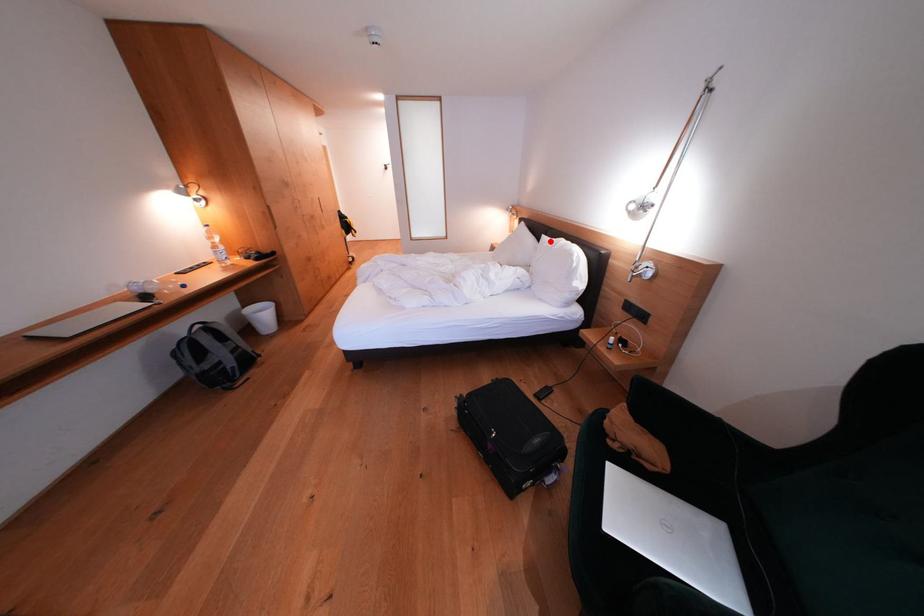
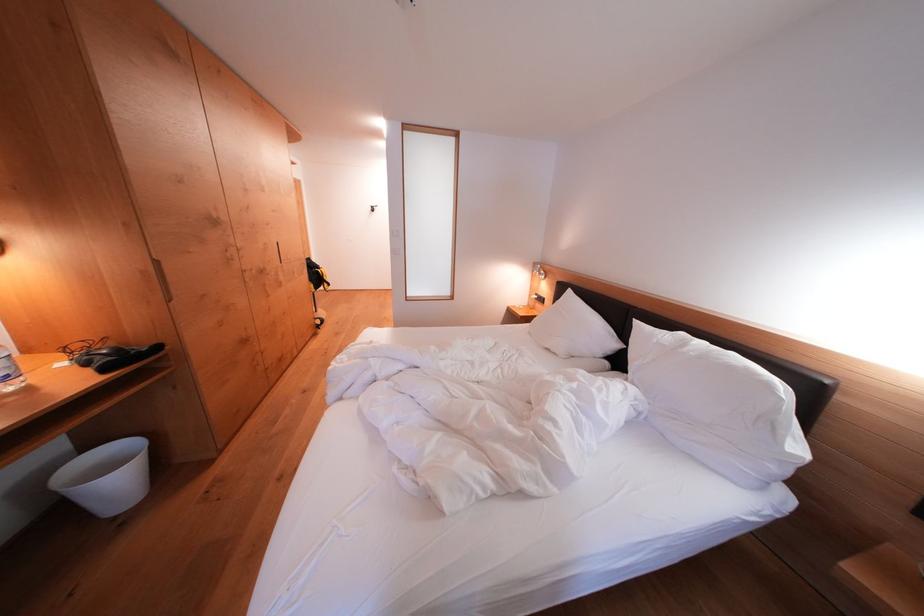
Locate, in the second image, the point that corresponds to the highlighted location in the first image.

(642, 326)